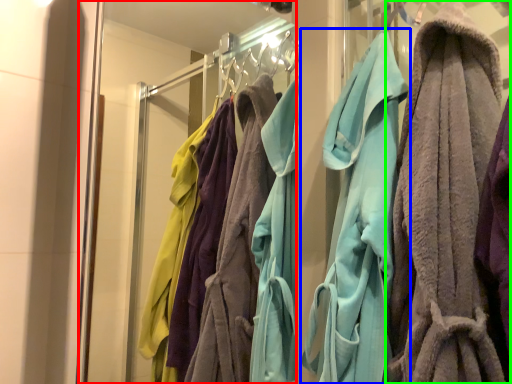
Question: Which is farther away from glass door (highlighted by a red box)? towel (highlighted by a blue box) or towel (highlighted by a green box)?

Choices:
 (A) towel
 (B) towel

Answer: (B)